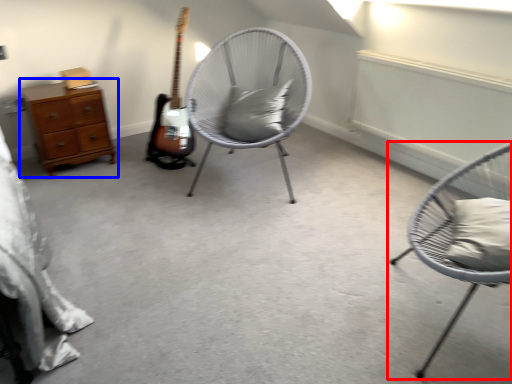
Question: Which object is further to the camera taking this photo, chair (highlighted by a red box) or chest of drawers (highlighted by a blue box)?

Choices:
 (A) chair
 (B) chest of drawers

Answer: (B)